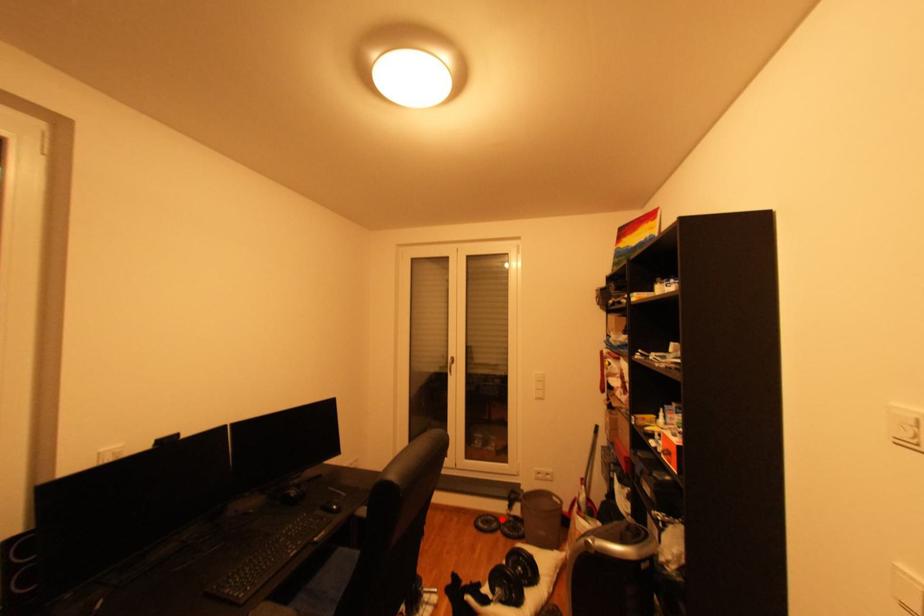
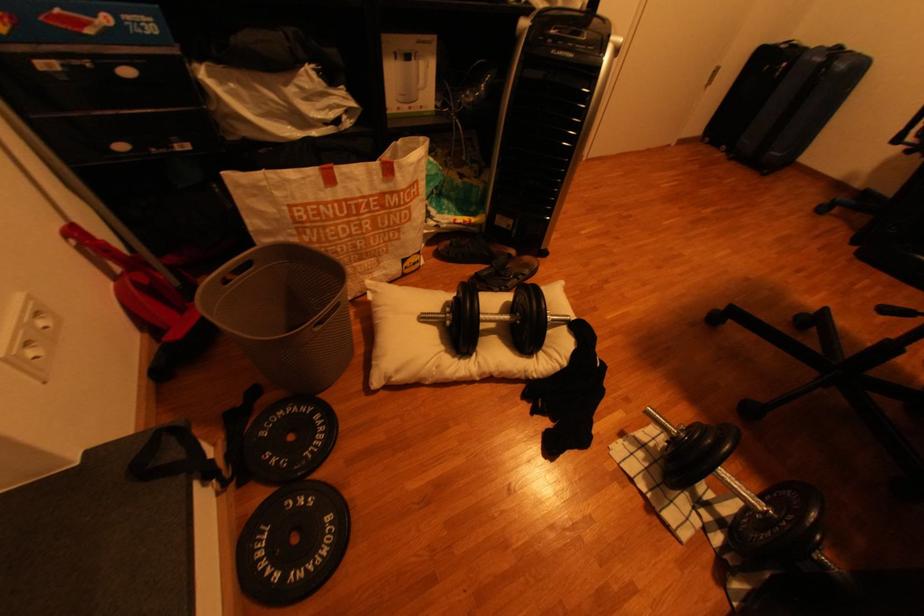
Question: I am providing you with two images of the same scene from different viewpoints. Given a red point in image1, look at the same physical point in image2. Is it:

Choices:
 (A) Closer to the viewpoint
 (B) Farther from the viewpoint

Answer: (A)